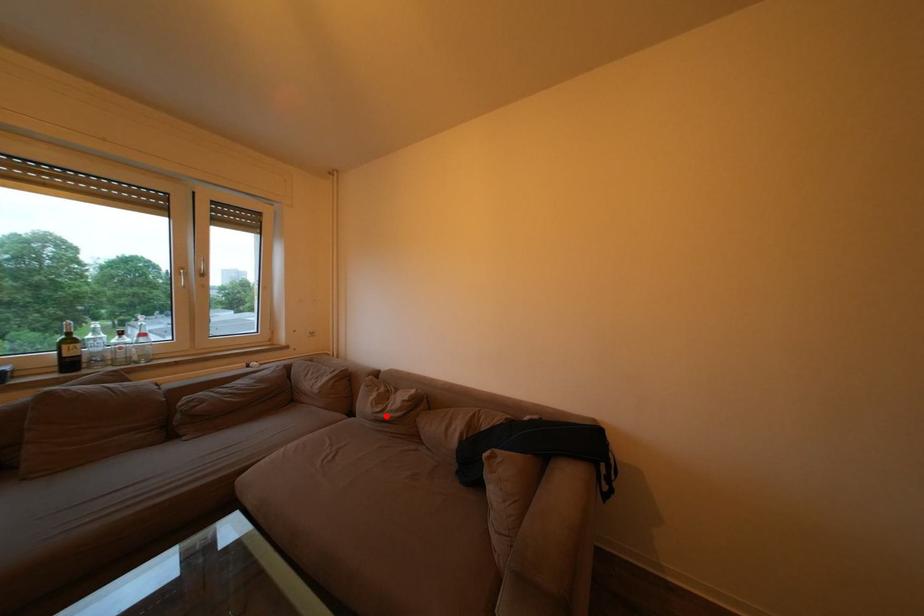
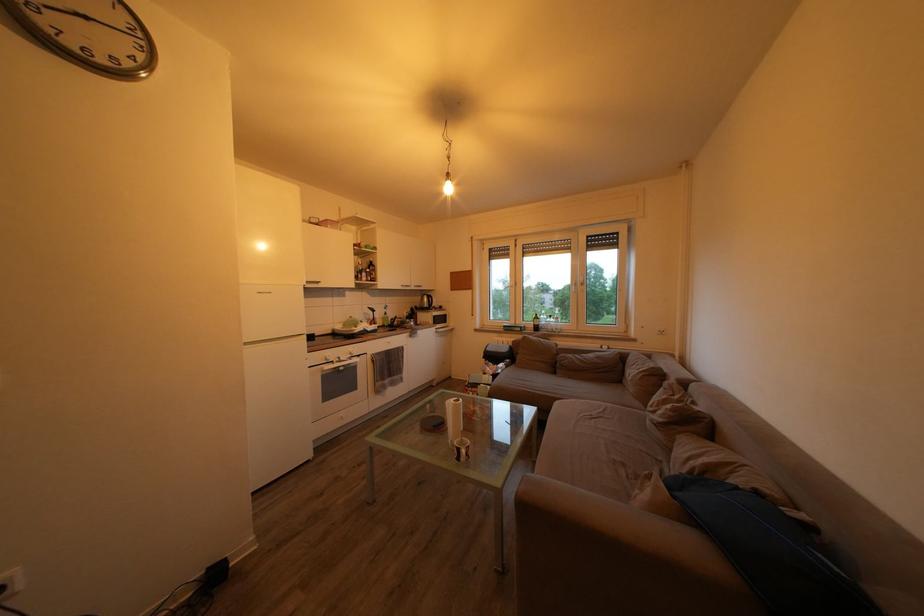
Question: I am providing you with two images of the same scene from different viewpoints. Given a red point in image1, look at the same physical point in image2. Is it:

Choices:
 (A) Closer to the viewpoint
 (B) Farther from the viewpoint

Answer: (A)